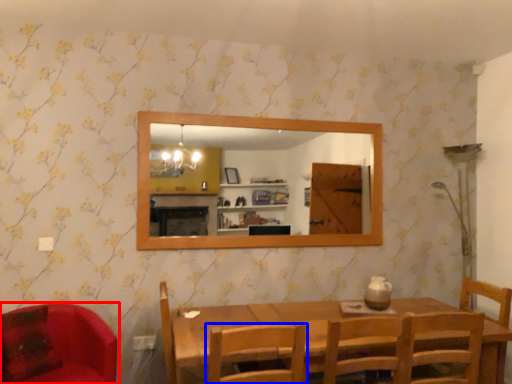
Question: Among these objects, which one is nearest to the camera, chair (highlighted by a red box) or chair (highlighted by a blue box)?

Choices:
 (A) chair
 (B) chair

Answer: (B)